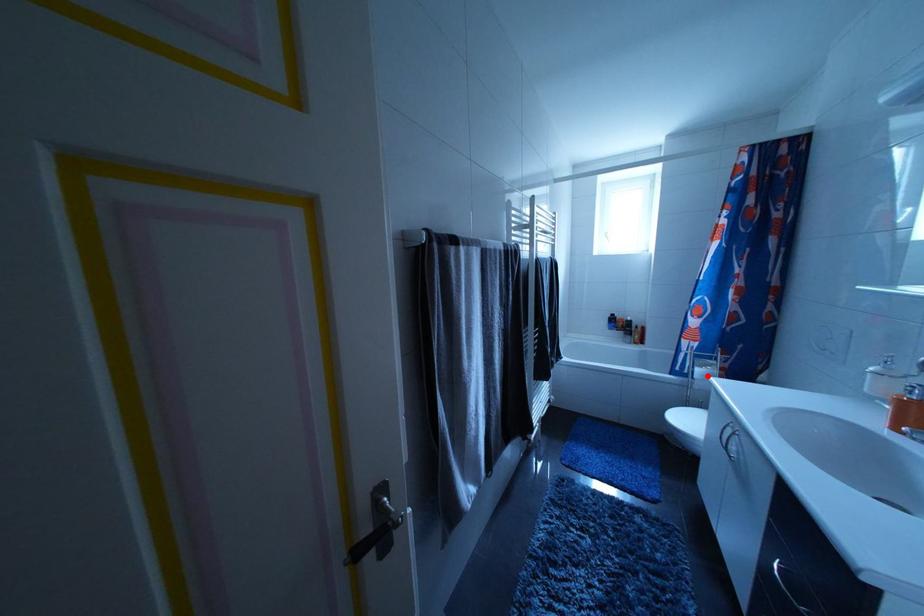
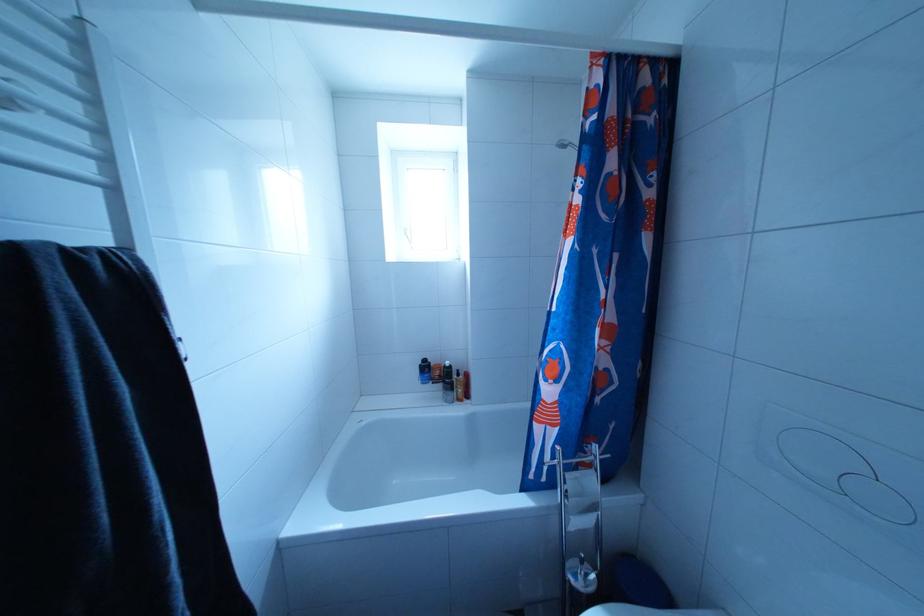
In the second image, find the point that corresponds to the highlighted location in the first image.

(578, 493)